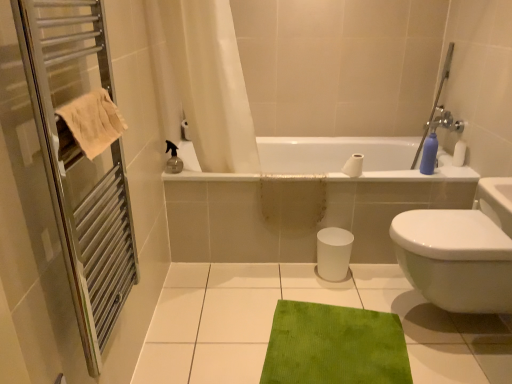
You are a GUI agent. You are given a task and a screenshot of the screen. Output one action in this format:
    pyautogui.click(x=<x>, y=<y>)
    Task: Click on the vacant space situated above green velvety bath mat at center (from a real-world perspective)
    This screenshot has height=384, width=512.
    Given the screenshot: What is the action you would take?
    pyautogui.click(x=337, y=344)